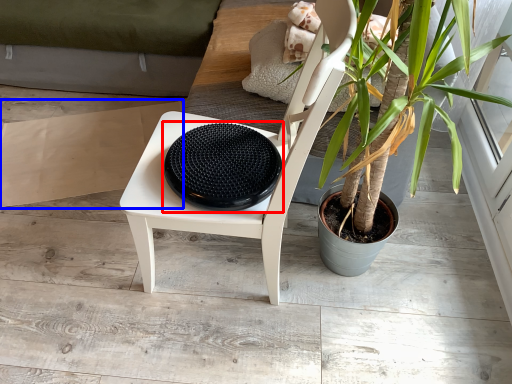
Question: Which object appears farthest to the camera in this image, manhole cover (highlighted by a red box) or cardboard (highlighted by a blue box)?

Choices:
 (A) manhole cover
 (B) cardboard

Answer: (B)